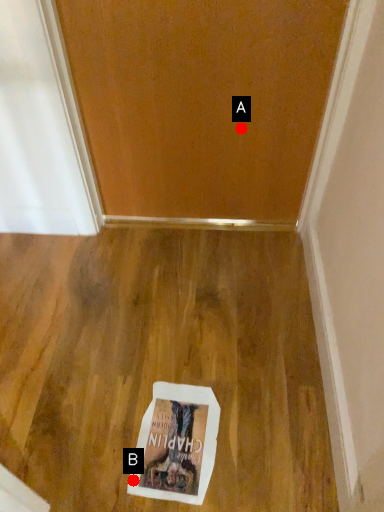
Question: Two points are circled on the image, labeled by A and B beside each circle. Which point is closer to the camera taking this photo?

Choices:
 (A) A is closer
 (B) B is closer

Answer: (B)